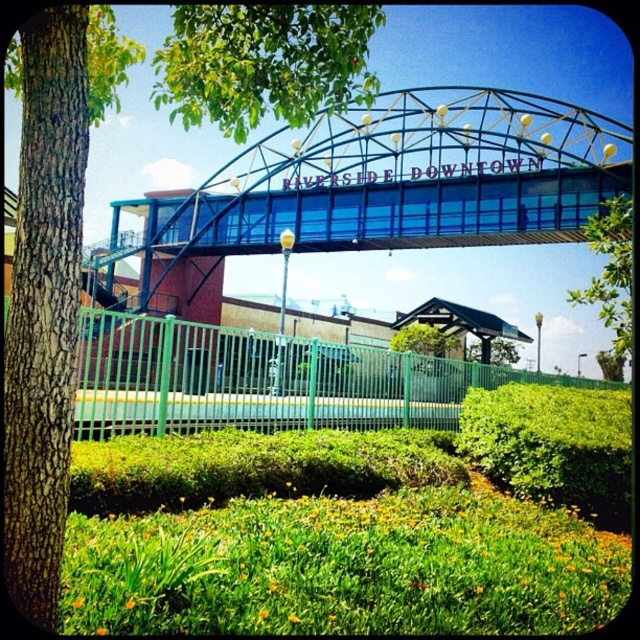
You are standing at the point marked as point (387, 186) in the image. What object are you directly facing?

The point (387, 186) corresponds to the blue glass pedestrian bridge at center, so you are directly facing the blue glass pedestrian bridge at center.

Based on the photo, you are a city planner reviewing the urban layout. Based on the scene, which object is positioned lower in the frame between the blue glass pedestrian bridge at center and the green leafy tree at center?

The blue glass pedestrian bridge at center is positioned below the green leafy tree at center, so it is lower in the frame.